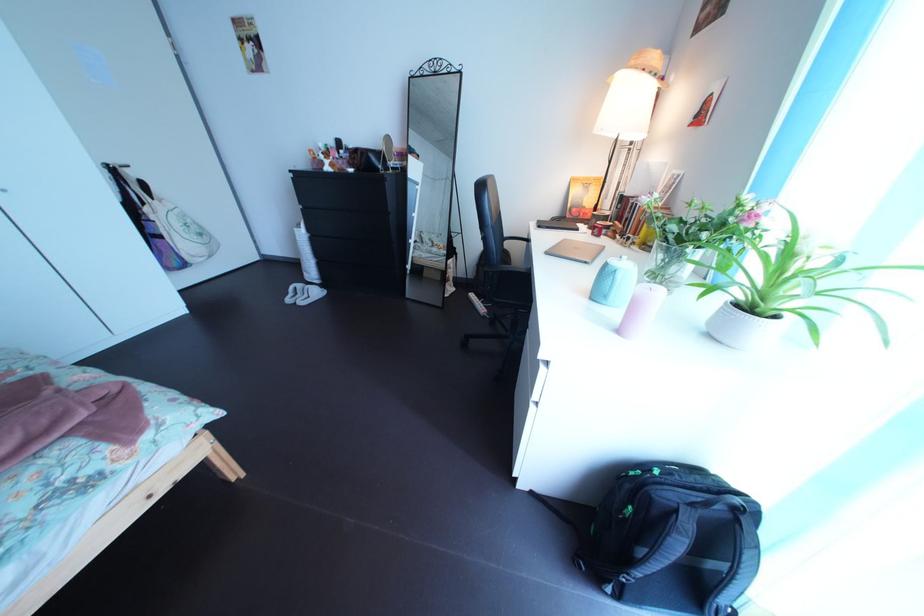
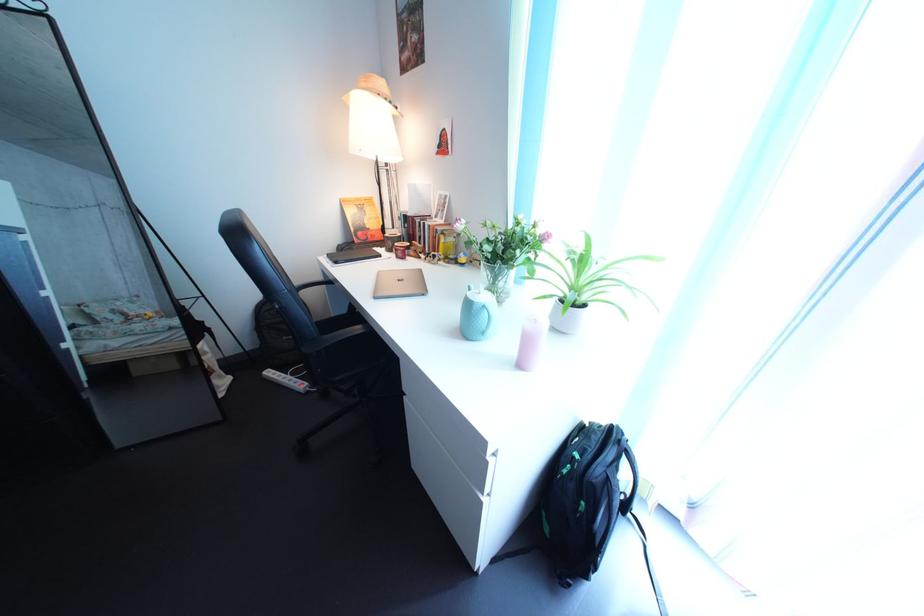
The point at (647, 71) is marked in the first image. Where is the corresponding point in the second image?

(378, 92)